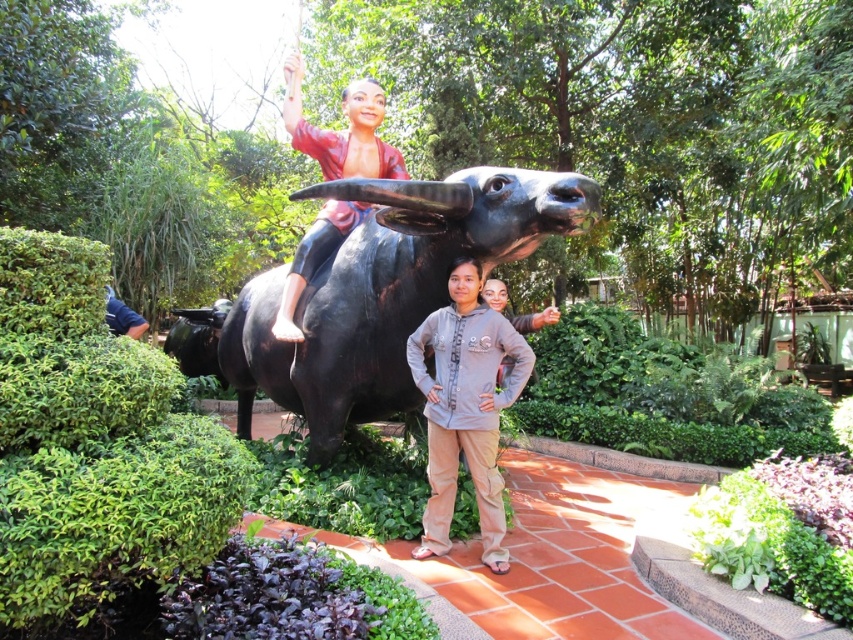
Question: Can you confirm if polished wood statue at center is positioned below blue fabric shirt at left?

Choices:
 (A) yes
 (B) no

Answer: (B)

Question: Is the position of polished wood statue at center more distant than that of blue fabric shirt at left?

Choices:
 (A) no
 (B) yes

Answer: (A)

Question: Which object is the closest to the gray cotton hoodie at center?

Choices:
 (A) blue fabric shirt at left
 (B) polished wood statue at center

Answer: (B)

Question: Which of the following is the closest to the observer?

Choices:
 (A) (456, 454)
 (B) (329, 252)
 (C) (343, 308)

Answer: (A)

Question: Which object is farther from the camera taking this photo?

Choices:
 (A) polished wood statue at center
 (B) shiny black bull at center
 (C) gray cotton hoodie at center
 (D) blue fabric shirt at left

Answer: (D)

Question: Does polished wood statue at center appear on the left side of blue fabric shirt at left?

Choices:
 (A) yes
 (B) no

Answer: (B)